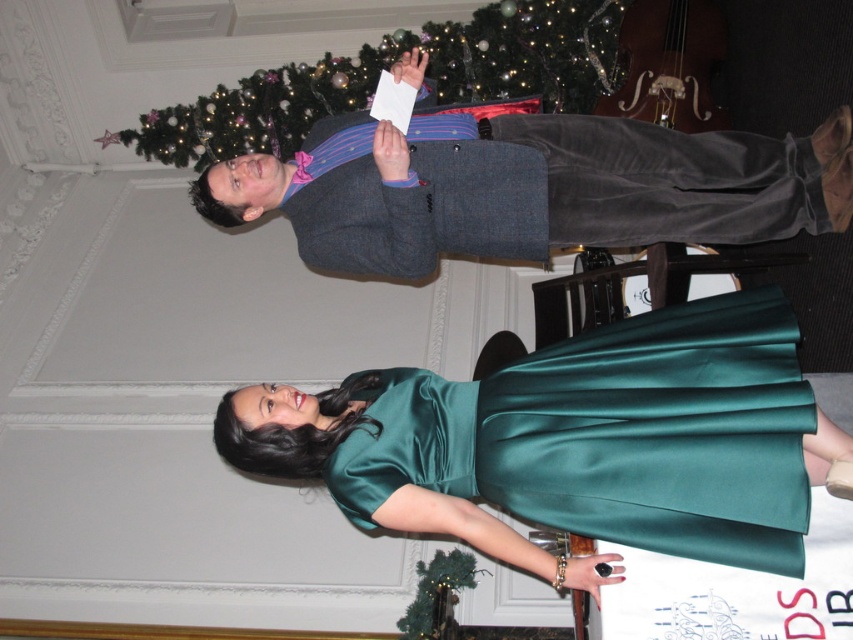
You are standing in the festive indoor setting and want to find the matte gray suit at center. According to the scene description, where should you look to find it?

The matte gray suit at center is located at the 2D coordinates point [541,192].

You are at a holiday party and see the green textured christmas tree at upper center and the green matte christmas tree at center. Which tree is located higher up in the image?

The green textured christmas tree at upper center is positioned over the green matte christmas tree at center, so it is higher up in the image.

You are organizing a charity event and need to ensure that the emerald satin dress at center and the green textured christmas tree at upper center are visible to all attendees. Based on their heights, which object should be placed on a raised platform to ensure visibility?

The emerald satin dress at center should be placed on a raised platform because it has a greater height compared to the green textured christmas tree at upper center, ensuring better visibility for all attendees.